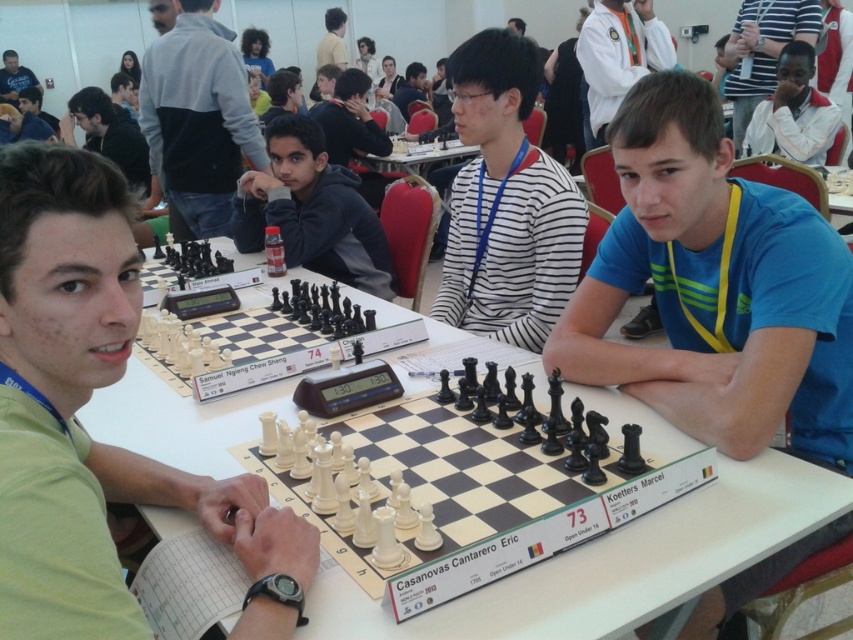
What are the coordinates of the matte black chess set at center?

The coordinates of the matte black chess set at center are at point (312,211).

You are a photographer trying to capture a clear photo of both the matte black chess set at center and the white cotton shirt at upper center. Based on their heights, which object will appear smaller in the photo?

The matte black chess set at center will appear smaller in the photo because it is shorter than the white cotton shirt at upper center.

You are a photographer standing at the back of the hall and want to take a photo of the chess set and the shirt. Which object should you focus on first if you want to capture both the matte black chess set at center and the white cotton shirt at upper center in the same frame?

The matte black chess set at center should be focused on first because it is positioned to the left of the white cotton shirt at upper center, allowing both to be captured in the same frame by adjusting the camera angle accordingly.